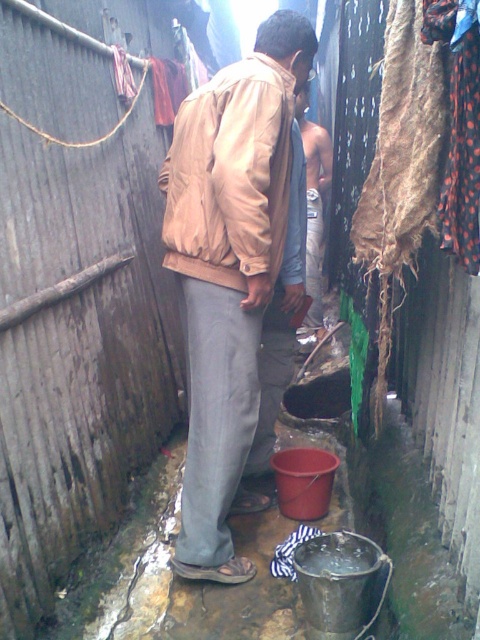
Is beige fabric jacket at center to the right of light brown leather jacket at center from the viewer's perspective?

Incorrect, beige fabric jacket at center is not on the right side of light brown leather jacket at center.

Who is positioned more to the right, beige fabric jacket at center or light brown leather jacket at center?

Positioned to the right is light brown leather jacket at center.

Does point (288, 97) lie in front of point (312, 180)?

Yes, point (288, 97) is closer to viewer.

You are a GUI agent. You are given a task and a screenshot of the screen. Output one action in this format:
    pyautogui.click(x=<x>, y=<y>)
    Task: Click on the beige fabric jacket at center
    The image size is (480, 640).
    Given the screenshot: What is the action you would take?
    pyautogui.click(x=228, y=269)

At what (x,y) coordinates should I click in order to perform the action: click on beige fabric jacket at center. Please return your answer as a coordinate pair (x, y). This screenshot has width=480, height=640. Looking at the image, I should click on (228, 269).

Between beige fabric jacket at center and matte beige jacket at center, which one is positioned lower?

beige fabric jacket at center is lower down.

Is point (225, 122) behind point (271, 264)?

No, it is in front of (271, 264).

Where is `beige fabric jacket at center`? Image resolution: width=480 pixels, height=640 pixels. beige fabric jacket at center is located at coordinates (228, 269).

Is point (250, 218) more distant than point (312, 152)?

No.

Is matte beige jacket at center behind light brown leather jacket at center?

No.

At what (x,y) coordinates should I click in order to perform the action: click on matte beige jacket at center. Please return your answer as a coordinate pair (x, y). Looking at the image, I should click on (229, 176).